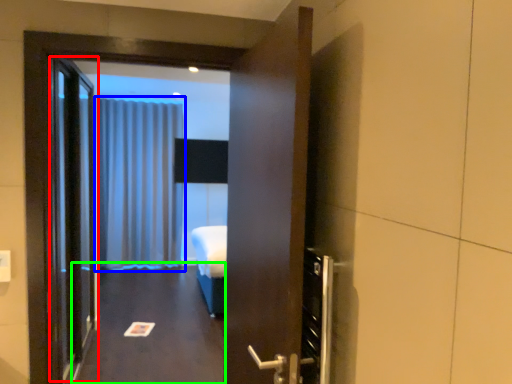
Question: Which object is positioned closest to elevator door (highlighted by a red box)? Select from curtain (highlighted by a blue box) and corridor (highlighted by a green box).

Choices:
 (A) curtain
 (B) corridor

Answer: (B)